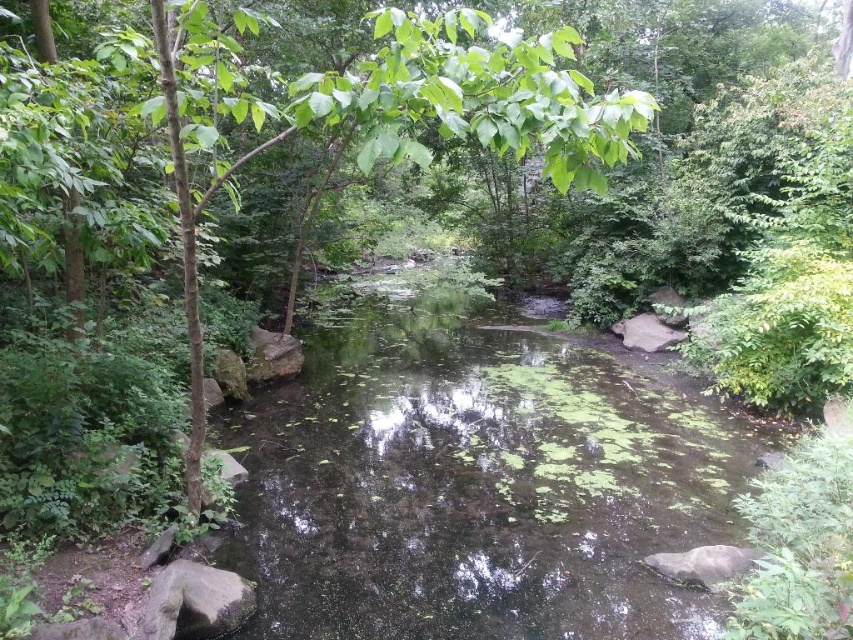
Question: Does green algae-covered water at center appear under green leafy tree at center?

Choices:
 (A) no
 (B) yes

Answer: (B)

Question: Does green algae-covered water at center appear over green leafy tree at center?

Choices:
 (A) no
 (B) yes

Answer: (A)

Question: From the image, what is the correct spatial relationship of green algae-covered water at center in relation to green leafy tree at center?

Choices:
 (A) below
 (B) above

Answer: (A)